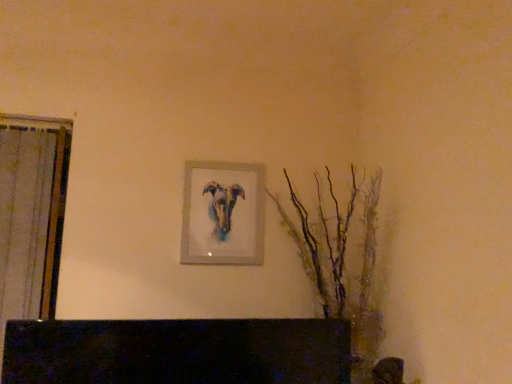
Image resolution: width=512 pixels, height=384 pixels. What do you see at coordinates (223, 213) in the screenshot?
I see `matte silver picture frame at center` at bounding box center [223, 213].

In order to face matte silver picture frame at center, should I rotate leftwards or rightwards?

A 4.225 degree turn to the left will do.

What are the coordinates of `matte silver picture frame at center` in the screenshot? It's located at (223, 213).

Measure the distance between point (186, 173) and camera.

A distance of 1.70 meters exists between point (186, 173) and camera.

Where is `translucent glass branches at right`? translucent glass branches at right is located at coordinates (335, 242).

This screenshot has width=512, height=384. What do you see at coordinates (335, 242) in the screenshot? I see `translucent glass branches at right` at bounding box center [335, 242].

I want to click on matte silver picture frame at center, so click(x=223, y=213).

Consider the image. Does matte silver picture frame at center appear on the left side of translucent glass branches at right?

Yes, matte silver picture frame at center is to the left of translucent glass branches at right.

Between matte silver picture frame at center and translucent glass branches at right, which one is positioned behind?

matte silver picture frame at center is more distant.

Is point (205, 261) more distant than point (344, 305)?

That is True.

From the image's perspective, would you say matte silver picture frame at center is positioned over translucent glass branches at right?

Correct, matte silver picture frame at center appears higher than translucent glass branches at right in the image.

From a real-world perspective, which is physically below, matte silver picture frame at center or translucent glass branches at right?

translucent glass branches at right.

Is matte silver picture frame at center thinner than translucent glass branches at right?

Correct, the width of matte silver picture frame at center is less than that of translucent glass branches at right.

Who is taller, matte silver picture frame at center or translucent glass branches at right?

With more height is translucent glass branches at right.

Considering the sizes of matte silver picture frame at center and translucent glass branches at right in the image, is matte silver picture frame at center bigger or smaller than translucent glass branches at right?

Considering their sizes, matte silver picture frame at center takes up less space than translucent glass branches at right.

Can we say matte silver picture frame at center lies outside translucent glass branches at right?

That's correct, matte silver picture frame at center is outside of translucent glass branches at right.

In the scene shown: Is matte silver picture frame at center positioned far away from translucent glass branches at right?

matte silver picture frame at center is actually quite close to translucent glass branches at right.

Is matte silver picture frame at center facing towards translucent glass branches at right?

No, matte silver picture frame at center is not aimed at translucent glass branches at right.

Locate an element on the screen. Image resolution: width=512 pixels, height=384 pixels. picture frame above the translucent glass branches at right (from a real-world perspective) is located at coordinates point(223,213).

Which object is positioned more to the right, translucent glass branches at right or matte silver picture frame at center?

From the viewer's perspective, translucent glass branches at right appears more on the right side.

Which is behind, translucent glass branches at right or matte silver picture frame at center?

matte silver picture frame at center.

Is point (303, 210) closer or farther from the camera than point (219, 215)?

Point (303, 210) appears to be farther away from the viewer than point (219, 215).

Based on the photo, from the image's perspective, is translucent glass branches at right under matte silver picture frame at center?

Correct, translucent glass branches at right appears lower than matte silver picture frame at center in the image.

From a real-world perspective, which object stands above the other?

In real-world perspective, matte silver picture frame at center is above.

Does translucent glass branches at right have a greater width compared to matte silver picture frame at center?

Yes.

Who is shorter, translucent glass branches at right or matte silver picture frame at center?

With less height is matte silver picture frame at center.

Which of these two, translucent glass branches at right or matte silver picture frame at center, is smaller?

With smaller size is matte silver picture frame at center.

Is matte silver picture frame at center surrounded by translucent glass branches at right?

No, matte silver picture frame at center is located outside of translucent glass branches at right.

Is translucent glass branches at right next to matte silver picture frame at center?

No, translucent glass branches at right is not with matte silver picture frame at center.

Is translucent glass branches at right oriented towards matte silver picture frame at center?

No, translucent glass branches at right is not oriented towards matte silver picture frame at center.

From the picture: How far apart are translucent glass branches at right and matte silver picture frame at center?

translucent glass branches at right is 10.26 inches away from matte silver picture frame at center.

The width and height of the screenshot is (512, 384). What are the coordinates of `tree below the matte silver picture frame at center (from a real-world perspective)` in the screenshot? It's located at (335, 242).

Locate an element on the screen. The height and width of the screenshot is (384, 512). picture frame above the translucent glass branches at right (from a real-world perspective) is located at coordinates (223, 213).

This screenshot has width=512, height=384. In order to click on tree that appears below the matte silver picture frame at center (from a real-world perspective) in this screenshot , I will do `click(335, 242)`.